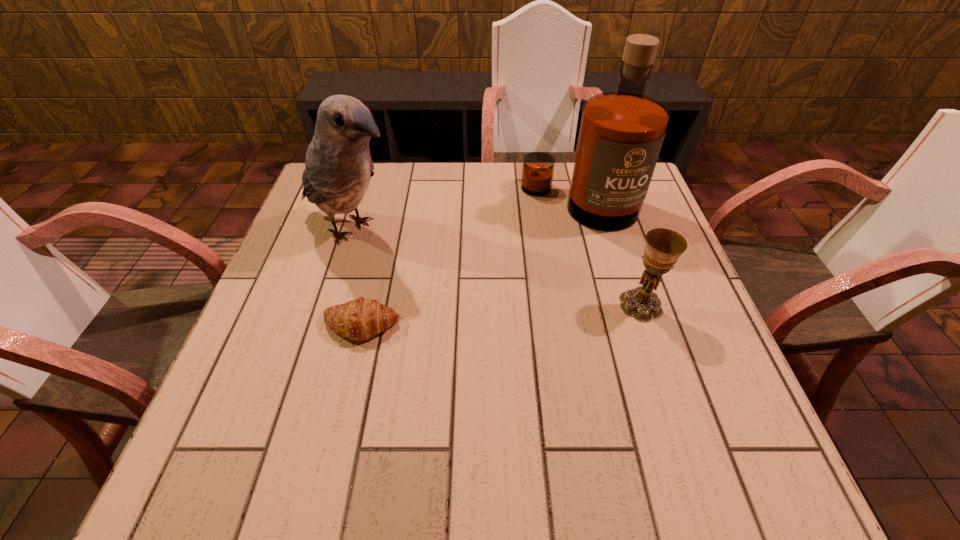
Find the location of `free space on the desktop that is between the crescent roll and the chalice and is positioned on the front-facing side of the second tallest object`. free space on the desktop that is between the crescent roll and the chalice and is positioned on the front-facing side of the second tallest object is located at coordinates pos(513,314).

This screenshot has height=540, width=960. I want to click on vacant space on the desktop that is between the shortest object and the chalice and is positioned on the front label of the liquor, so click(526, 313).